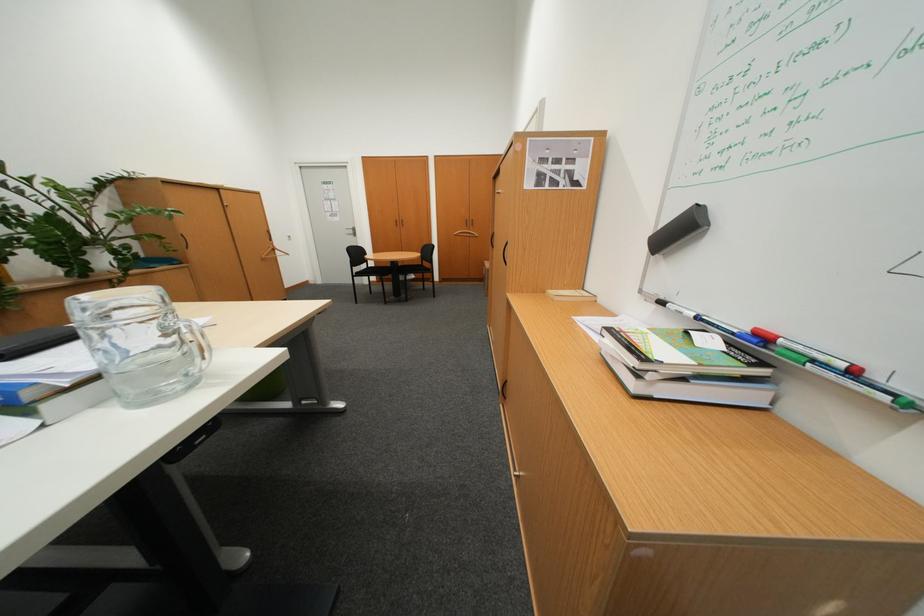
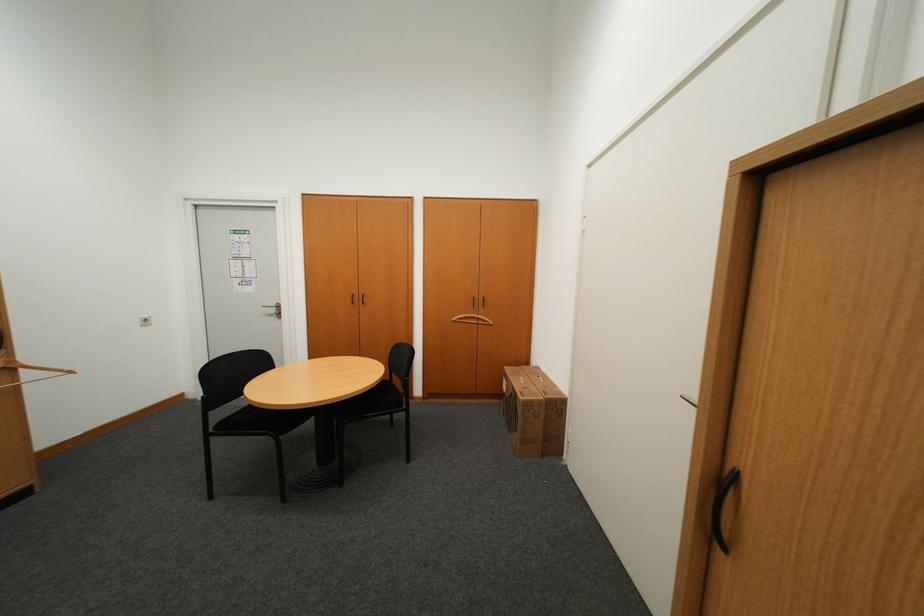
Question: Which direction would the cameraman need to move to produce the second image? Reply with the corresponding letter.

Choices:
 (A) Left
 (B) Right
 (C) Forward
 (D) Backward

Answer: (C)